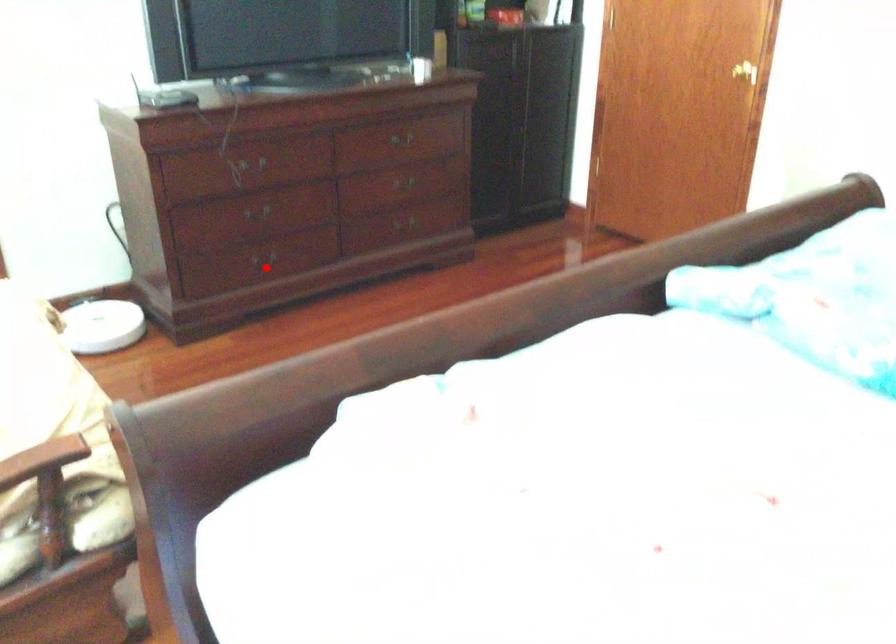
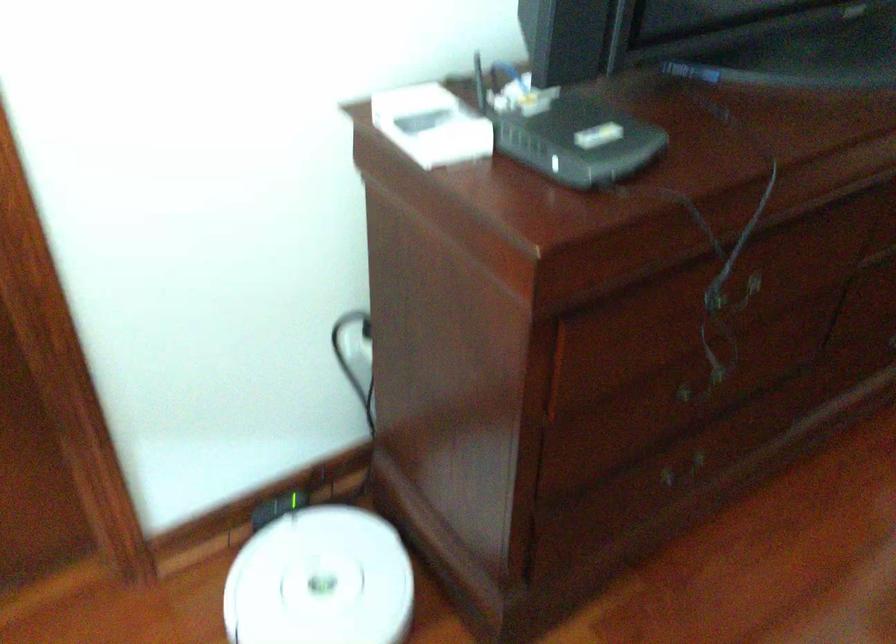
Question: A red point is marked in image1. In image2, is the corresponding 3D point closer to the camera or farther? Reply with the corresponding letter.

Choices:
 (A) The corresponding 3D point is closer.
 (B) The corresponding 3D point is farther.

Answer: (A)